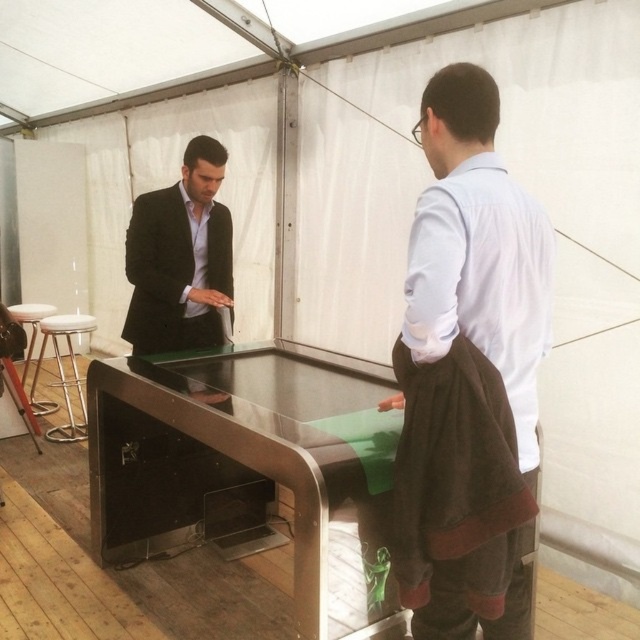
Which is above, black matte suit at center or white fabric stool at left?

black matte suit at center

Is black matte suit at center wider than white fabric stool at left?

No.

The width and height of the screenshot is (640, 640). In order to click on black matte suit at center in this screenshot , I will do `click(180, 257)`.

Where is `black matte suit at center`? This screenshot has height=640, width=640. black matte suit at center is located at coordinates (180, 257).

The height and width of the screenshot is (640, 640). Describe the element at coordinates (477, 250) in the screenshot. I see `brown woolen sweater at center` at that location.

Is point (484, 83) farther from viewer compared to point (218, 228)?

No, (484, 83) is in front of (218, 228).

Identify the location of brown woolen sweater at center. (477, 250).

Who is lower down, black matte suit at center or white leather stool at left?

white leather stool at left

Can you confirm if black matte suit at center is positioned below white leather stool at left?

No, black matte suit at center is not below white leather stool at left.

Describe the element at coordinates (180, 257) in the screenshot. I see `black matte suit at center` at that location.

Where is `black matte suit at center`? Image resolution: width=640 pixels, height=640 pixels. black matte suit at center is located at coordinates (180, 257).